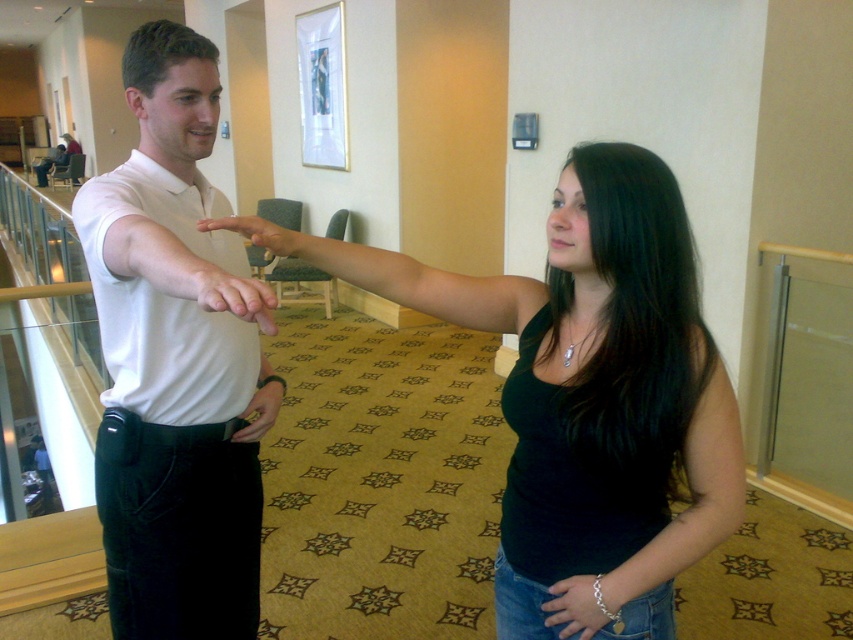
Is matte white hand at center positioned behind matte skin hand at center?

No.

Measure the distance between matte white hand at center and camera.

matte white hand at center is 32.33 inches away from camera.

Locate an element on the screen. This screenshot has height=640, width=853. matte white hand at center is located at coordinates (229, 292).

Which is more to the right, white matte shirt at center or matte white hand at center?

From the viewer's perspective, matte white hand at center appears more on the right side.

Is point (257, 403) positioned after point (201, 285)?

Yes, point (257, 403) is behind point (201, 285).

Which is in front, point (186, 147) or point (221, 305)?

Point (221, 305) is more forward.

At what (x,y) coordinates should I click in order to perform the action: click on white matte shirt at center. Please return your answer as a coordinate pair (x, y). This screenshot has width=853, height=640. Looking at the image, I should click on (173, 365).

Does point (544, 547) come closer to viewer compared to point (270, 224)?

No, (544, 547) is behind (270, 224).

This screenshot has width=853, height=640. Identify the location of black matte tank top at center. 593,392.